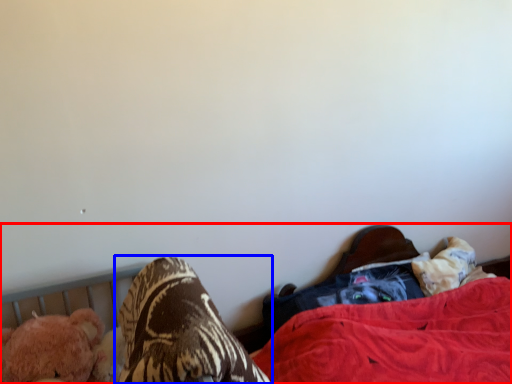
Question: Which point is further to the camera, bed (highlighted by a red box) or footwear (highlighted by a blue box)?

Choices:
 (A) bed
 (B) footwear

Answer: (A)